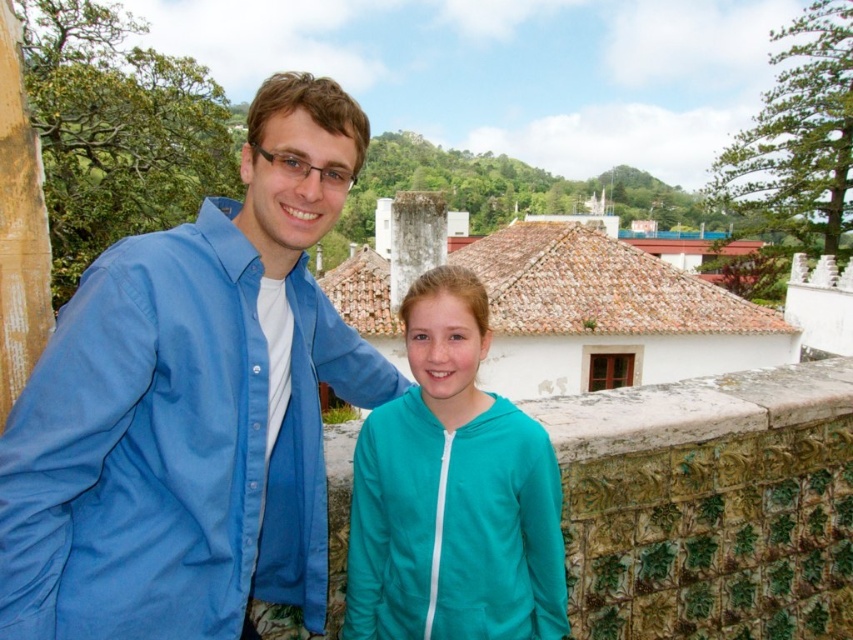
Based on the photo, you are a photographer trying to capture a group photo of two people. You see the blue cotton shirt at left and the teal fleece jacket at center. Which person should you position to your left to ensure they are aligned with their current positions?

The blue cotton shirt at left should be positioned to your left since it is already on the left side of the teal fleece jacket at center.

You are a photographer planning to take a photo of the blue cotton shirt at left and the teal fleece jacket at center. Based on their heights, which one should you focus on first if you want to ensure both are in focus?

The blue cotton shirt at left is taller than the teal fleece jacket at center, so focusing on the taller one first would help ensure both are in focus.